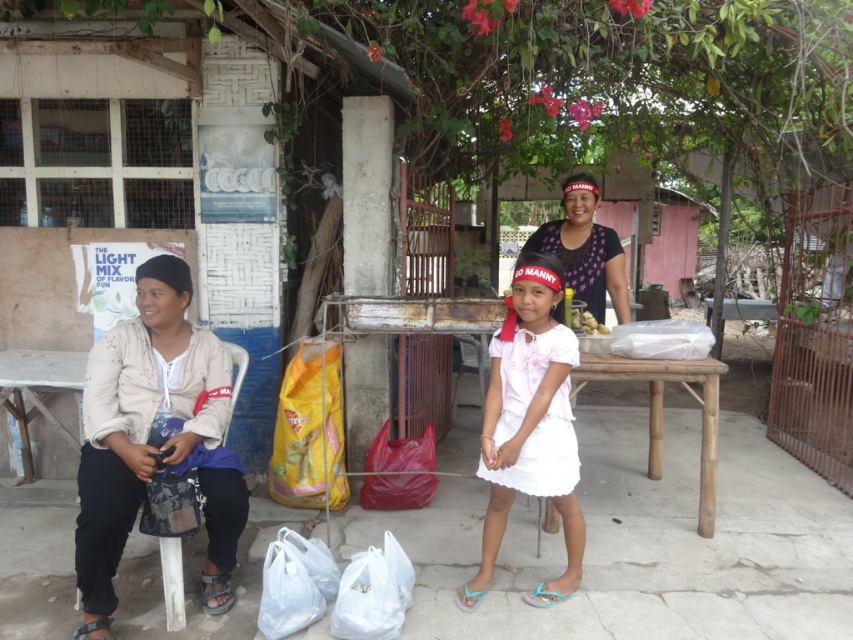
Does white cotton dress at center appear over matte pink fabric at center?

Incorrect, white cotton dress at center is not positioned above matte pink fabric at center.

The height and width of the screenshot is (640, 853). Describe the element at coordinates (529, 426) in the screenshot. I see `white cotton dress at center` at that location.

The image size is (853, 640). What are the coordinates of `white cotton dress at center` in the screenshot? It's located at (529, 426).

Who is positioned more to the left, white painted wood hut at left or white cotton dress at center?

white painted wood hut at left

Between white painted wood hut at left and white cotton dress at center, which one has more height?

white painted wood hut at left

Who is more forward, (386, 280) or (508, 369)?

Positioned in front is point (508, 369).

This screenshot has height=640, width=853. In order to click on white painted wood hut at left in this screenshot , I will do `click(195, 161)`.

Is matte white shirt at left further to camera compared to matte pink fabric at center?

No, matte white shirt at left is closer to the viewer.

Who is more forward, (192, 419) or (595, 259)?

Point (192, 419) is more forward.

Locate an element on the screen. The image size is (853, 640). matte white shirt at left is located at coordinates (154, 442).